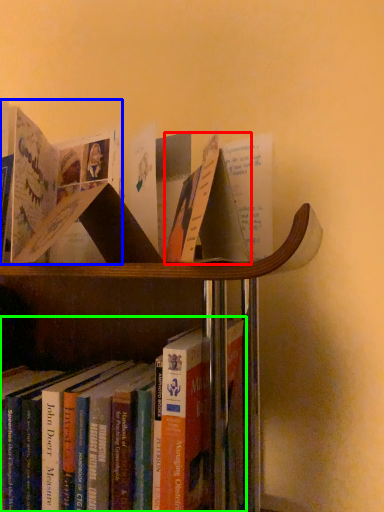
Question: Considering the real-world distances, which object is closest to paperback book (highlighted by a red box)? book (highlighted by a blue box) or book (highlighted by a green box).

Choices:
 (A) book
 (B) book

Answer: (B)